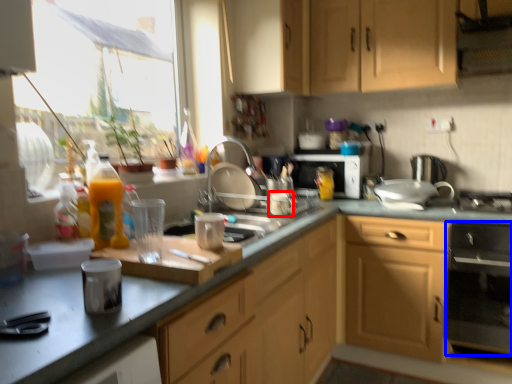
Question: Which of the following is the closest to the observer, appliance (highlighted by a red box) or kitchen appliance (highlighted by a blue box)?

Choices:
 (A) appliance
 (B) kitchen appliance

Answer: (B)